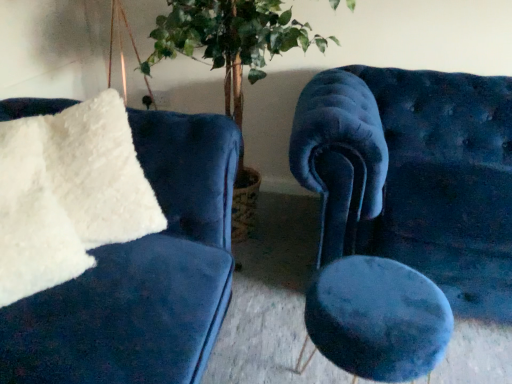
Question: Does velvet blue chair at right have a lesser width compared to white fluffy pillow at left?

Choices:
 (A) no
 (B) yes

Answer: (A)

Question: Does velvet blue chair at right appear on the right side of white fluffy pillow at left?

Choices:
 (A) yes
 (B) no

Answer: (A)

Question: Considering the relative positions of velvet blue chair at right and white fluffy pillow at left in the image provided, is velvet blue chair at right in front of white fluffy pillow at left?

Choices:
 (A) no
 (B) yes

Answer: (A)

Question: From the image's perspective, is velvet blue chair at right over white fluffy pillow at left?

Choices:
 (A) no
 (B) yes

Answer: (A)

Question: From a real-world perspective, is velvet blue chair at right on top of white fluffy pillow at left?

Choices:
 (A) yes
 (B) no

Answer: (B)

Question: Do you think velvet blue chair at right is within green leafy plant at center, or outside of it?

Choices:
 (A) outside
 (B) inside

Answer: (A)

Question: Visually, is velvet blue chair at right positioned to the left or to the right of green leafy plant at center?

Choices:
 (A) left
 (B) right

Answer: (B)

Question: From the image's perspective, is velvet blue chair at right positioned above or below green leafy plant at center?

Choices:
 (A) above
 (B) below

Answer: (B)

Question: From a real-world perspective, is velvet blue chair at right positioned above or below green leafy plant at center?

Choices:
 (A) above
 (B) below

Answer: (B)

Question: From a real-world perspective, is white fluffy pillow at left positioned above or below velvet blue stool at center?

Choices:
 (A) above
 (B) below

Answer: (A)

Question: Looking at the image, does white fluffy pillow at left seem bigger or smaller compared to velvet blue stool at center?

Choices:
 (A) big
 (B) small

Answer: (B)

Question: From their relative heights in the image, would you say white fluffy pillow at left is taller or shorter than velvet blue stool at center?

Choices:
 (A) short
 (B) tall

Answer: (B)

Question: Considering the positions of white fluffy pillow at left and velvet blue stool at center in the image, is white fluffy pillow at left wider or thinner than velvet blue stool at center?

Choices:
 (A) thin
 (B) wide

Answer: (A)

Question: Is velvet blue chair at right taller or shorter than white fluffy pillow at left?

Choices:
 (A) short
 (B) tall

Answer: (B)

Question: Considering the positions of velvet blue chair at right and white fluffy pillow at left in the image, is velvet blue chair at right wider or thinner than white fluffy pillow at left?

Choices:
 (A) wide
 (B) thin

Answer: (A)